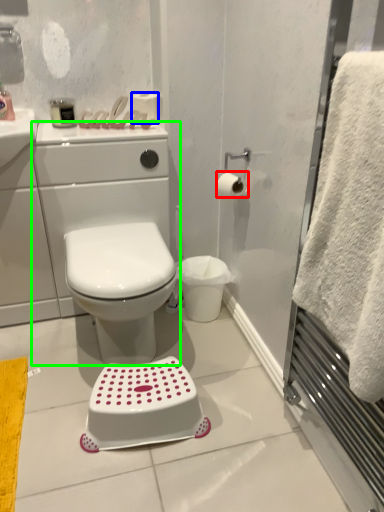
Question: Estimate the real-world distances between objects in this image. Which object is closer to toilet paper (highlighted by a red box), toilet paper (highlighted by a blue box) or porcelain (highlighted by a green box)?

Choices:
 (A) toilet paper
 (B) porcelain

Answer: (A)